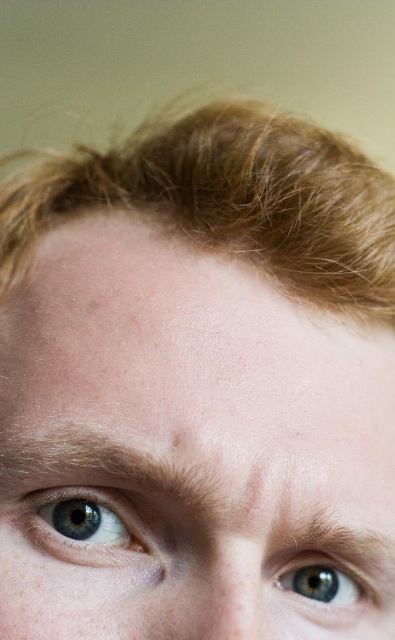
Question: Does light brown textured hair at upper center appear under blue matte eye at upper left?

Choices:
 (A) yes
 (B) no

Answer: (B)

Question: Which of the following is the closest to the observer?

Choices:
 (A) (73, 509)
 (B) (346, 573)
 (C) (186, 129)

Answer: (A)

Question: Is pale skin at center positioned at the back of blue matte eye at upper left?

Choices:
 (A) yes
 (B) no

Answer: (B)

Question: Is blue matte eye at upper left bigger than blue matte eye at center?

Choices:
 (A) no
 (B) yes

Answer: (B)

Question: Considering the real-world distances, which object is farthest from the blue matte eye at center?

Choices:
 (A) light brown textured hair at upper center
 (B) pale skin at center
 (C) blue matte eye at upper left

Answer: (A)

Question: Estimate the real-world distances between objects in this image. Which object is farther from the light brown textured hair at upper center?

Choices:
 (A) blue matte eye at upper left
 (B) pale skin at center

Answer: (A)